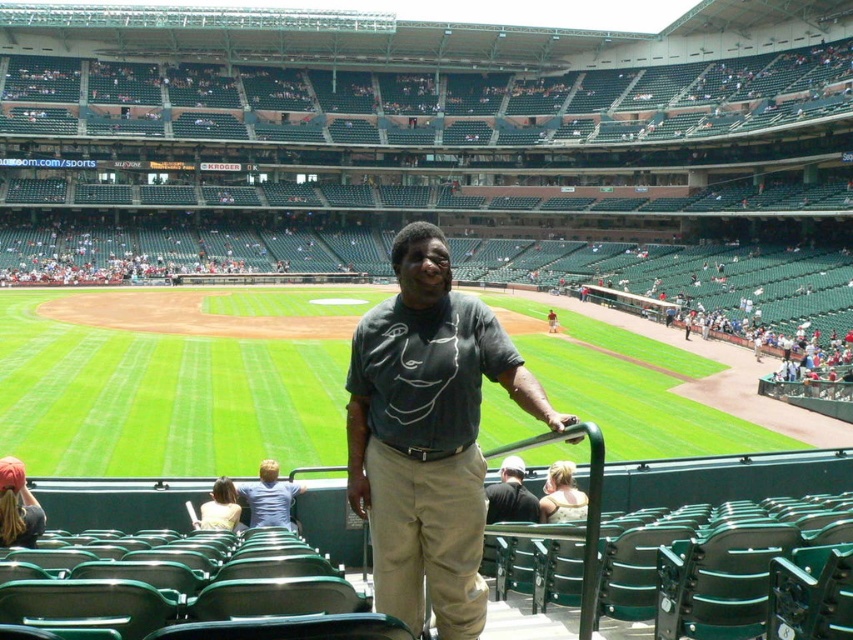
Can you confirm if dark gray shirt at center is bigger than matte gray shirt at center?

No.

Image resolution: width=853 pixels, height=640 pixels. What do you see at coordinates (511, 493) in the screenshot?
I see `dark gray shirt at center` at bounding box center [511, 493].

Is point (519, 465) farther from viewer compared to point (550, 310)?

No, it is not.

What are the coordinates of `dark gray shirt at center` in the screenshot? It's located at (511, 493).

Is dark gray t-shirt at center positioned behind matte gray shirt at center?

No, it is not.

You are a GUI agent. You are given a task and a screenshot of the screen. Output one action in this format:
    pyautogui.click(x=<x>, y=<y>)
    Task: Click on the dark gray t-shirt at center
    The image size is (853, 640).
    Given the screenshot: What is the action you would take?
    pyautogui.click(x=428, y=435)

Does point (448, 308) come behind point (550, 320)?

No.

In order to click on dark gray t-shirt at center in this screenshot , I will do `click(428, 435)`.

Can you confirm if dark gray t-shirt at center is wider than light blue shirt at center?

Correct, the width of dark gray t-shirt at center exceeds that of light blue shirt at center.

Who is more forward, (x=397, y=552) or (x=276, y=484)?

Point (x=397, y=552) is more forward.

Which is behind, point (426, 452) or point (236, 484)?

Point (236, 484)

This screenshot has width=853, height=640. In order to click on dark gray t-shirt at center in this screenshot , I will do `click(428, 435)`.